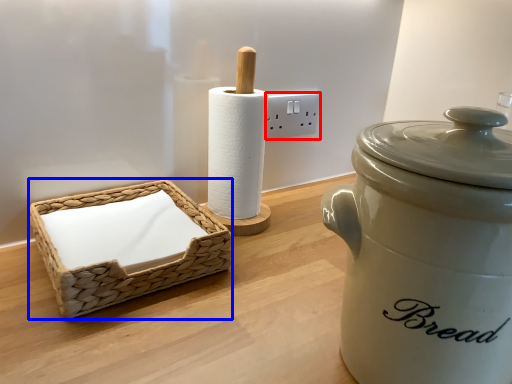
Question: Among these objects, which one is farthest to the camera, electric outlet (highlighted by a red box) or basket (highlighted by a blue box)?

Choices:
 (A) electric outlet
 (B) basket

Answer: (A)